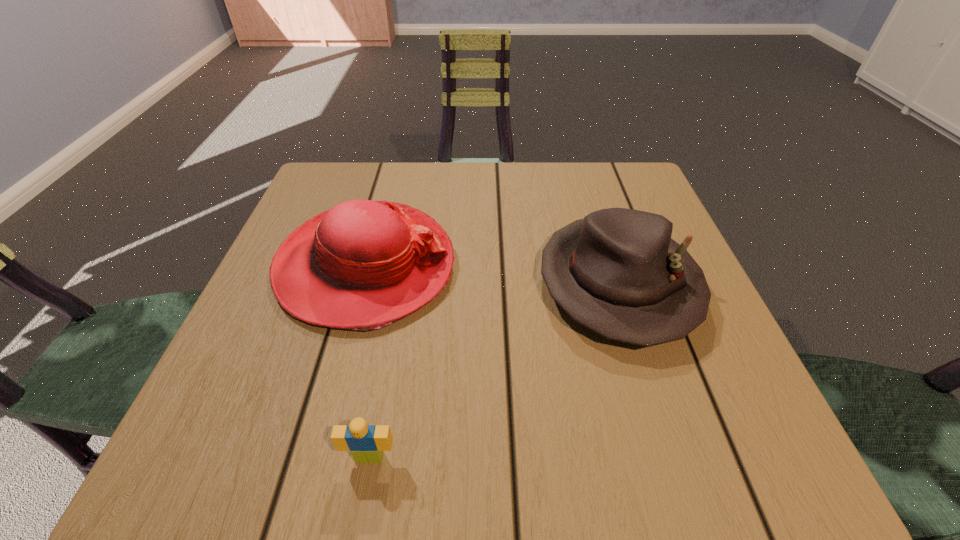
Where is `vacant space that's between the nearest object and the left hat`? The height and width of the screenshot is (540, 960). vacant space that's between the nearest object and the left hat is located at coordinates (368, 362).

Find the location of a particular element. Image resolution: width=960 pixels, height=540 pixels. free spot between the left hat and the Lego is located at coordinates (368, 362).

Find the location of a particular element. This screenshot has height=540, width=960. empty location between the nearest object and the right hat is located at coordinates (493, 370).

Find the location of a particular element. The image size is (960, 540). free space between the left hat and the shortest object is located at coordinates (368, 362).

Where is `vacant area that lies between the shortest object and the left hat`? vacant area that lies between the shortest object and the left hat is located at coordinates (368, 362).

Locate an element on the screen. The image size is (960, 540). unoccupied position between the left hat and the shortest object is located at coordinates (368, 362).

Locate an element on the screen. vacant space in between the rightmost object and the nearest object is located at coordinates [493, 370].

Locate an element on the screen. The width and height of the screenshot is (960, 540). vacant space that's between the shortest object and the left hat is located at coordinates (368, 362).

Select which object is the closest to the rightmost object. Please provide its 2D coordinates. Your answer should be formatted as a tuple, i.e. [(x, y)], where the tuple contains the x and y coordinates of a point satisfying the conditions above.

[(362, 265)]

The width and height of the screenshot is (960, 540). I want to click on the second closest object to the left hat, so click(366, 443).